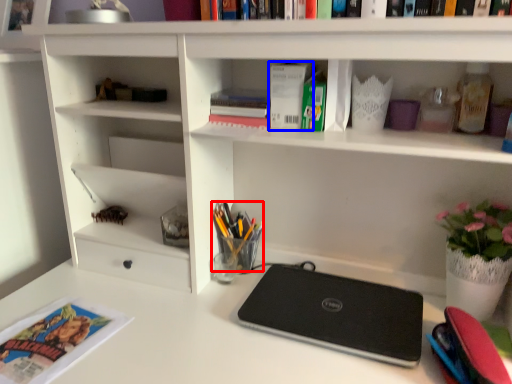
Question: Among these objects, which one is nearest to the camera, stationery (highlighted by a red box) or paperback book (highlighted by a blue box)?

Choices:
 (A) stationery
 (B) paperback book

Answer: (B)